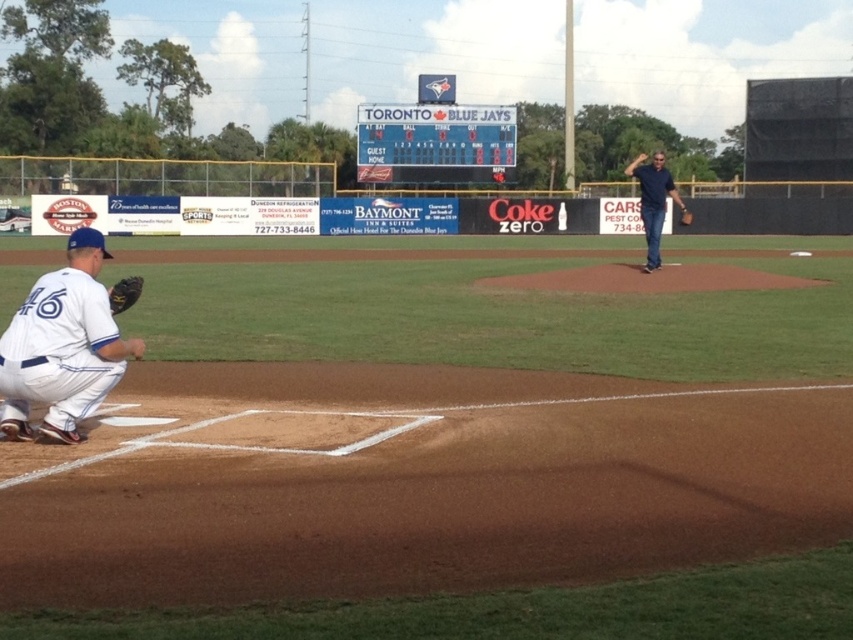
Question: Does white uniform at lower left have a greater width compared to brown leather glove at center?

Choices:
 (A) yes
 (B) no

Answer: (A)

Question: Which of the following is the closest to the observer?

Choices:
 (A) blue jeans at center
 (B) white plastic scoreboard at upper center
 (C) white uniform at lower left

Answer: (C)

Question: Can you confirm if white plastic scoreboard at upper center is thinner than blue jeans at center?

Choices:
 (A) yes
 (B) no

Answer: (A)

Question: From the image, what is the correct spatial relationship of blue jeans at center in relation to dark brown leather glove at lower left?

Choices:
 (A) above
 (B) below

Answer: (A)

Question: Which object appears farthest from the camera in this image?

Choices:
 (A) white plastic scoreboard at upper center
 (B) brown leather glove at center

Answer: (A)

Question: Which point is farther to the camera?

Choices:
 (A) dark brown leather glove at lower left
 (B) brown leather glove at center
 (C) white uniform at lower left
 (D) blue jeans at center

Answer: (B)